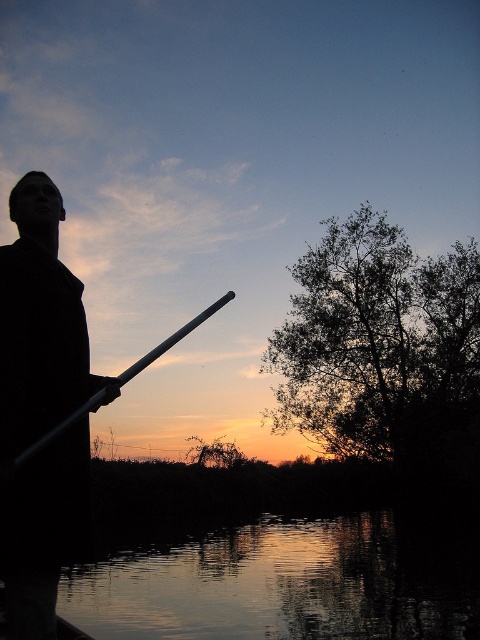
Does point (52, 486) come behind point (190, 326)?

No, it is in front of (190, 326).

This screenshot has width=480, height=640. What do you see at coordinates (41, 410) in the screenshot?
I see `black matte coat at left` at bounding box center [41, 410].

Is point (7, 308) positioned before point (100, 394)?

That is True.

Identify the location of black matte coat at left. (41, 410).

Which is behind, point (375, 536) or point (54, 232)?

Point (375, 536)

Which is in front, point (274, 516) or point (32, 572)?

Point (32, 572) is more forward.

The image size is (480, 640). What do you see at coordinates (288, 582) in the screenshot?
I see `silvery reflective water at lower center` at bounding box center [288, 582].

Find the location of `silvery reflective water at lower center`. silvery reflective water at lower center is located at coordinates (288, 582).

Which is behind, point (463, 552) or point (20, 458)?

The point (463, 552) is more distant.

Who is shorter, silvery reflective water at lower center or metallic silver paddle at center?

metallic silver paddle at center is shorter.

Does point (152, 605) lie in front of point (25, 460)?

No, it is not.

Locate an element on the screen. The image size is (480, 640). silvery reflective water at lower center is located at coordinates (288, 582).